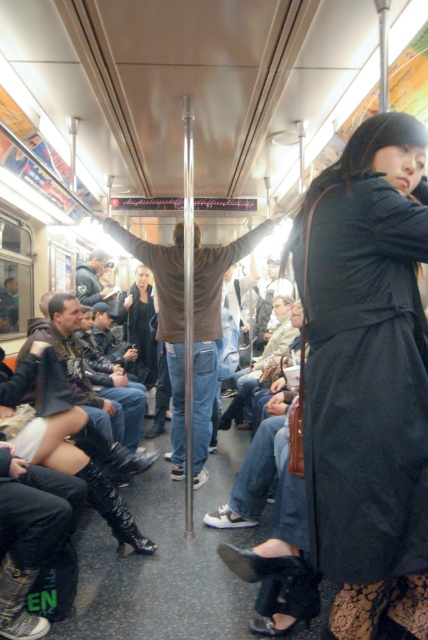
Looking at this image, can you confirm if black matte coat at center is wider than brown leather jacket at center?

No.

Between black matte coat at center and brown leather jacket at center, which one appears on the right side from the viewer's perspective?

From the viewer's perspective, black matte coat at center appears more on the right side.

Between point (329, 490) and point (149, 266), which one is positioned in front?

Point (329, 490) is in front.

Where is `black matte coat at center`? The image size is (428, 640). black matte coat at center is located at coordinates (366, 380).